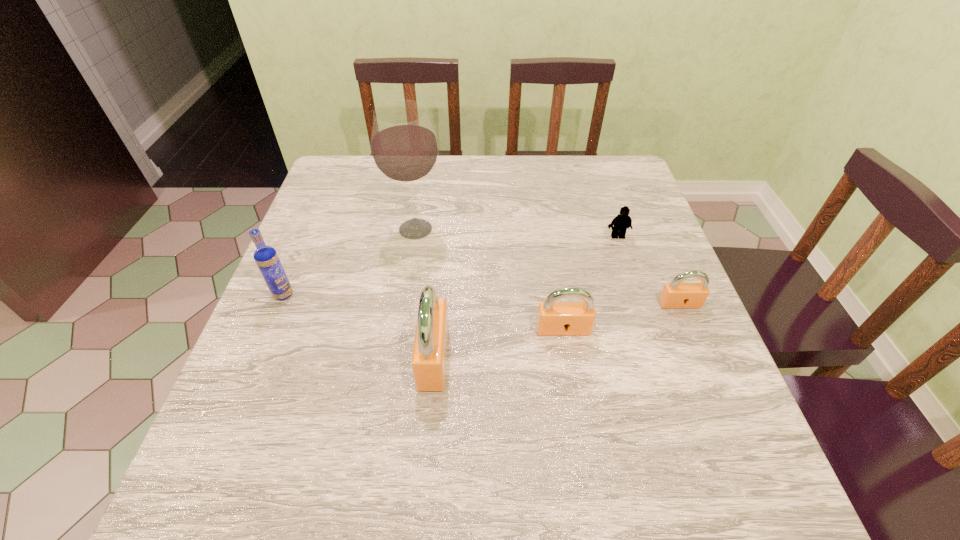
Locate an element on the screen. free location located 0.150m to unlock the tallest padlock from the front is located at coordinates (343, 357).

Locate an element on the screen. free location located to unlock the fourth object from left to right from the front is located at coordinates (567, 357).

I want to click on free space located to unlock the shortest padlock from the front, so click(704, 361).

Identify the location of free location located on the back of the leftmost object. The image size is (960, 540). (314, 220).

This screenshot has height=540, width=960. I want to click on free spot located 0.280m on the face of the Lego, so click(x=648, y=329).

This screenshot has height=540, width=960. In order to click on free spot located 0.180m on the front of the alcohol in this screenshot , I will do `click(403, 305)`.

Where is `object positioned at the left edge`? The width and height of the screenshot is (960, 540). object positioned at the left edge is located at coordinates (266, 257).

I want to click on padlock present at the right edge, so click(x=675, y=294).

Where is `Lego present at the right edge`? The height and width of the screenshot is (540, 960). Lego present at the right edge is located at coordinates (622, 221).

In the image, there is a desktop. Find the location of `vacant space at the far edge`. vacant space at the far edge is located at coordinates (501, 178).